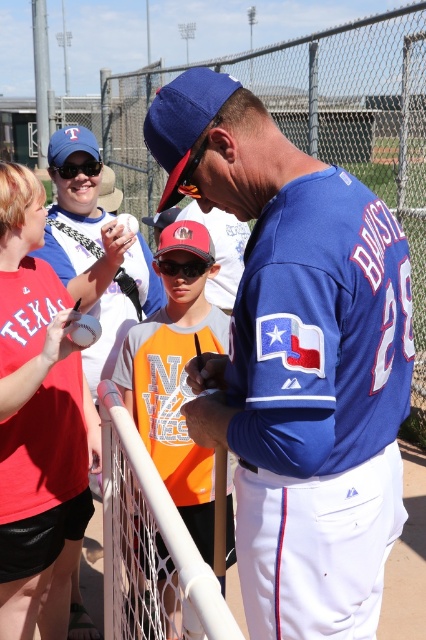
Between orange jersey at center and black plastic goggles at upper left, which one appears on the left side from the viewer's perspective?

Positioned to the left is black plastic goggles at upper left.

Image resolution: width=426 pixels, height=640 pixels. I want to click on orange jersey at center, so click(x=175, y=378).

Between point (245, 332) and point (111, 230), which one is positioned in front?

Point (245, 332) is more forward.

Is point (373, 458) farther from viewer compared to point (92, 364)?

No, (373, 458) is in front of (92, 364).

I want to click on blue jersey at center, so click(x=298, y=360).

Find the location of a particular element. The width and height of the screenshot is (426, 640). blue jersey at center is located at coordinates (298, 360).

Is point (9, 358) less distant than point (164, 442)?

Yes.

Between orange jersey at left and orange jersey at center, which one appears on the left side from the viewer's perspective?

orange jersey at left

Between point (58, 355) and point (158, 378), which one is positioned behind?

Positioned behind is point (158, 378).

This screenshot has height=640, width=426. In order to click on orange jersey at left in this screenshot , I will do `click(39, 422)`.